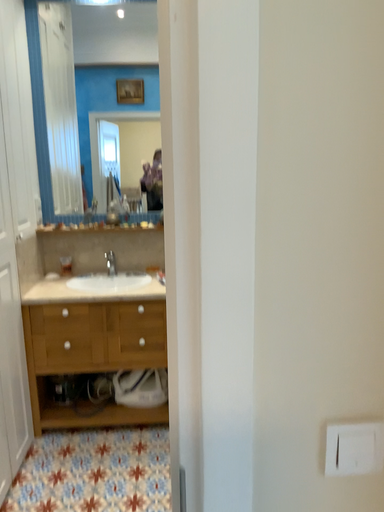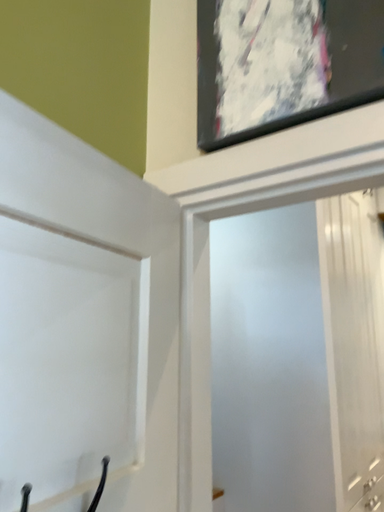
Question: How did the camera likely rotate when shooting the video?

Choices:
 (A) rotated right
 (B) rotated left

Answer: (B)